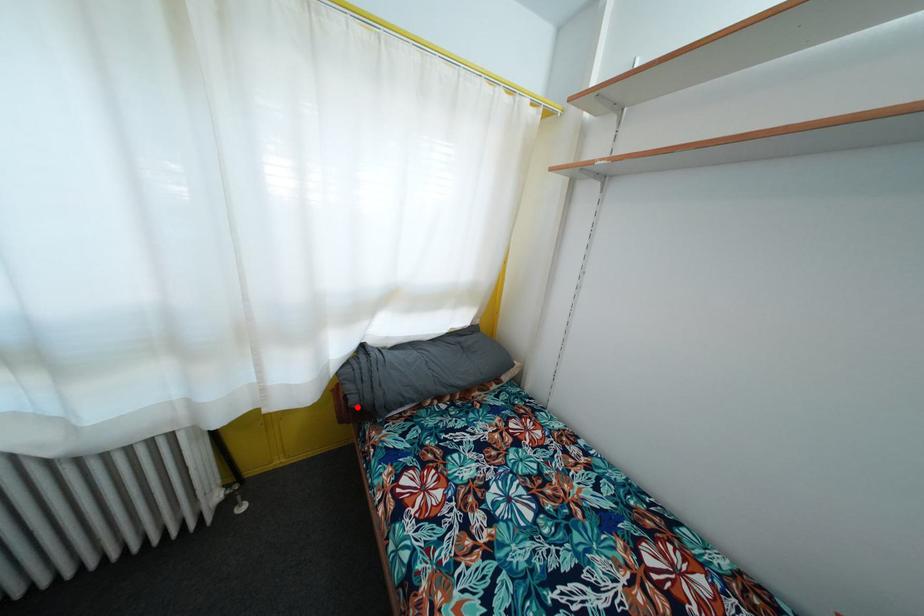
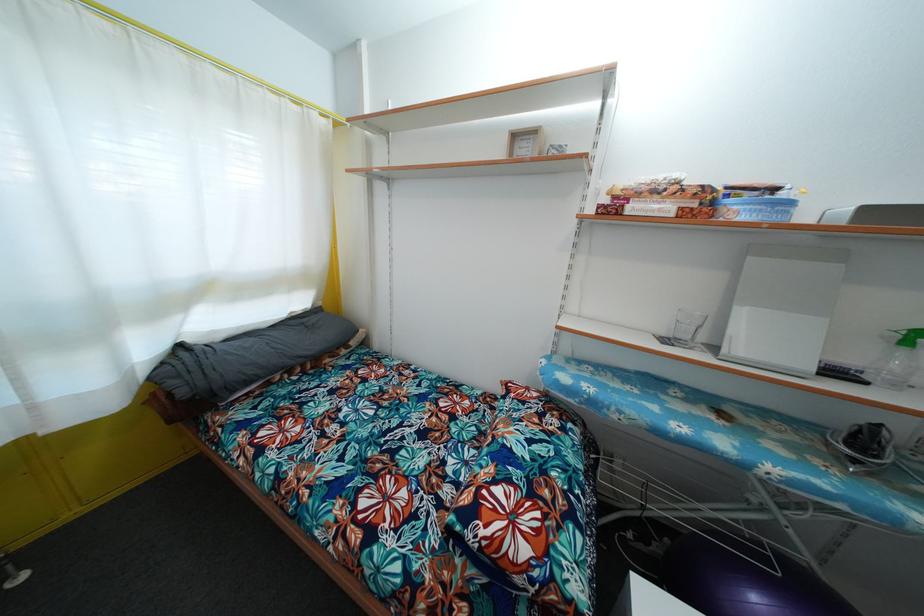
In the second image, find the point that corresponds to the highlighted location in the first image.

(187, 399)